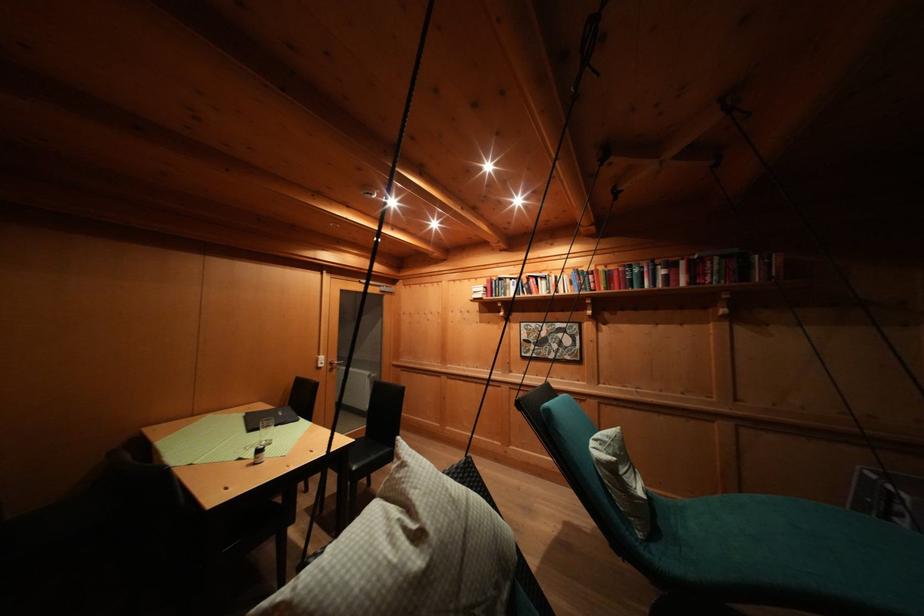
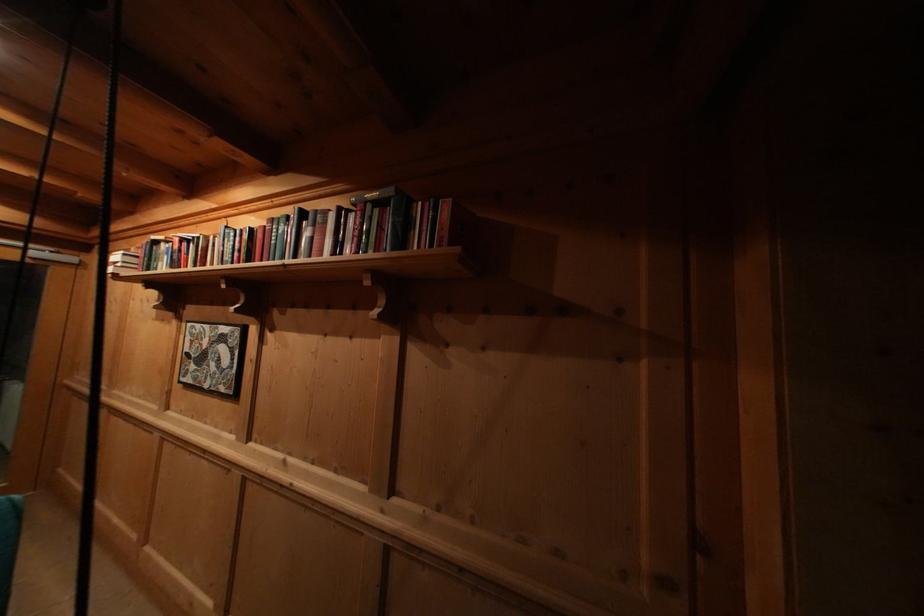
Find the pixel in the second image that matches (723,262) in the first image.

(375, 211)